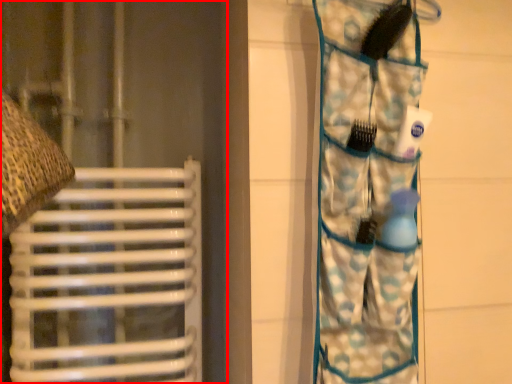
Question: From the image's perspective, where is curtain (annotated by the red box) located relative to camouflage?

Choices:
 (A) above
 (B) below

Answer: (A)